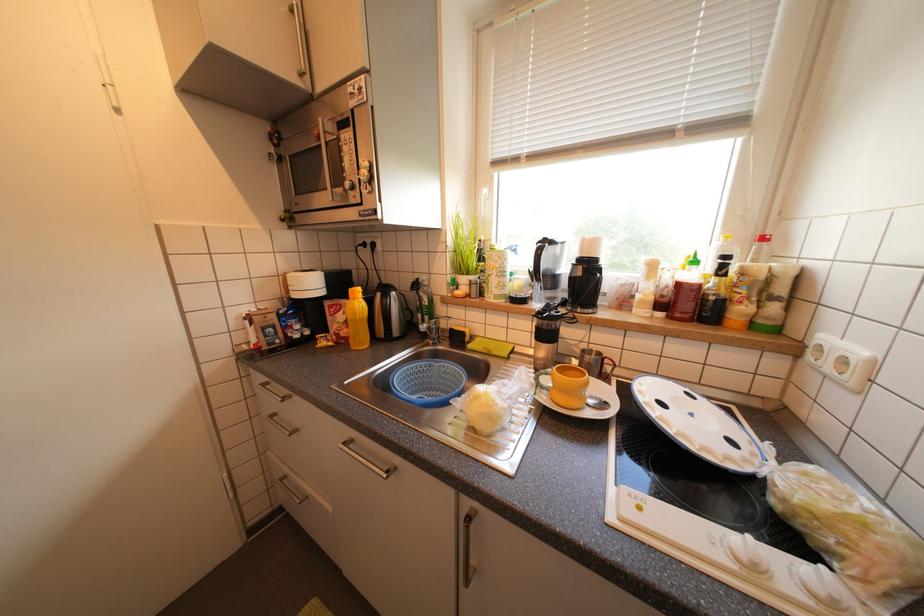
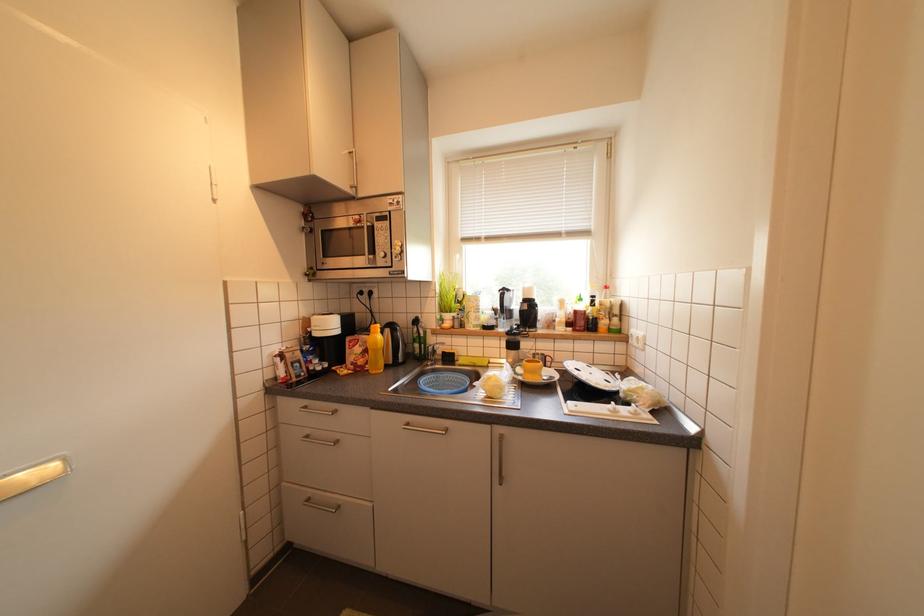
Question: Based on the continuous images, in which direction is the camera rotating? Reply with the corresponding letter.

Choices:
 (A) Left
 (B) Right
 (C) Up
 (D) Down

Answer: (B)